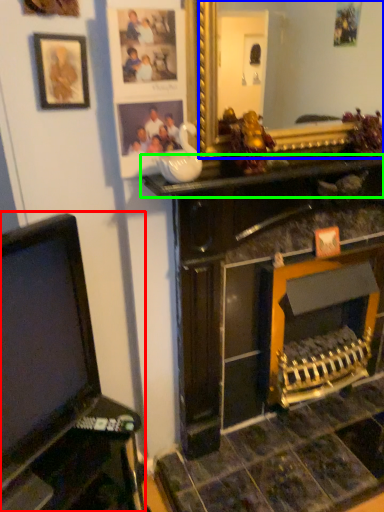
Question: Estimate the real-world distances between objects in this image. Which object is farther from furniture (highlighted by a red box), mirror (highlighted by a blue box) or counter top (highlighted by a green box)?

Choices:
 (A) mirror
 (B) counter top

Answer: (A)